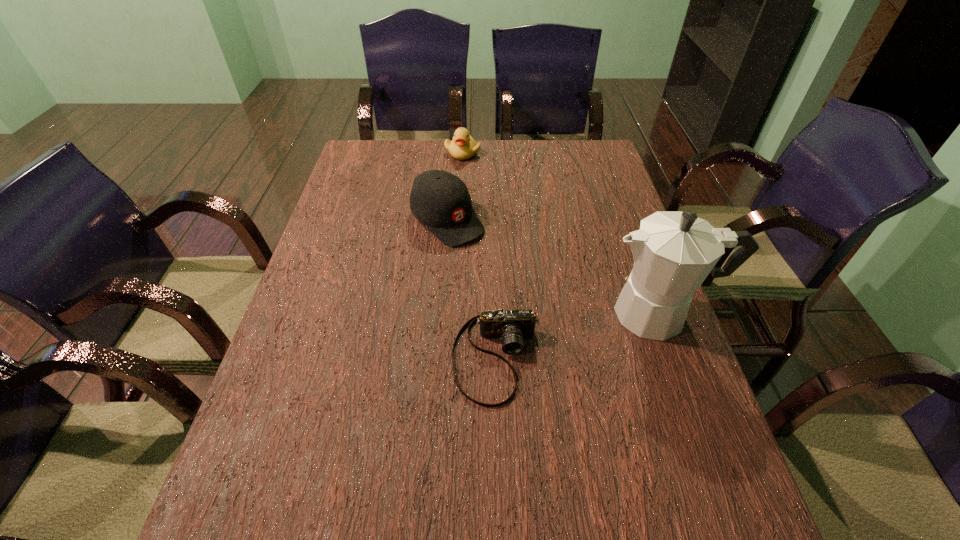
This screenshot has height=540, width=960. Identify the location of free space on the desktop that is between the shortest object and the tallest object and is positioned on the beak of the farthest object. (572, 337).

You are a GUI agent. You are given a task and a screenshot of the screen. Output one action in this format:
    pyautogui.click(x=<x>, y=<y>)
    Task: Click on the vacant space on the desktop that is between the shortest object and the tallest object and is positioned with a logo on the front of the second tallest object
    This screenshot has width=960, height=540.
    Given the screenshot: What is the action you would take?
    coord(573,336)